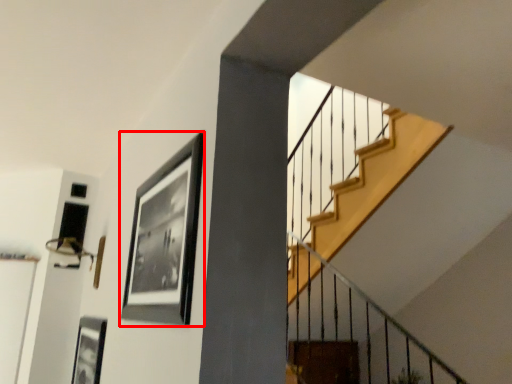
Question: From the image, what is the correct spatial relationship of picture frame (annotated by the red box) in relation to picture frame?

Choices:
 (A) left
 (B) right

Answer: (B)